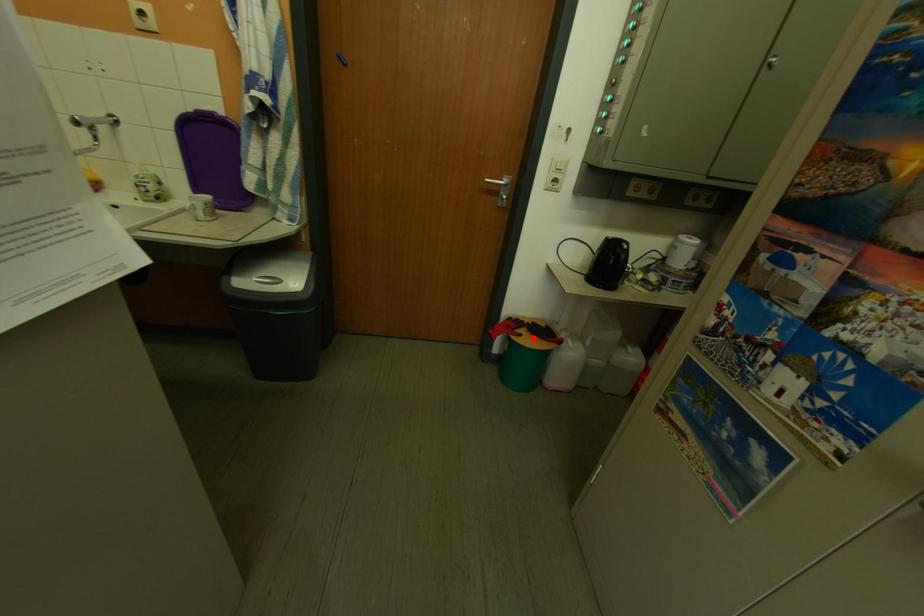
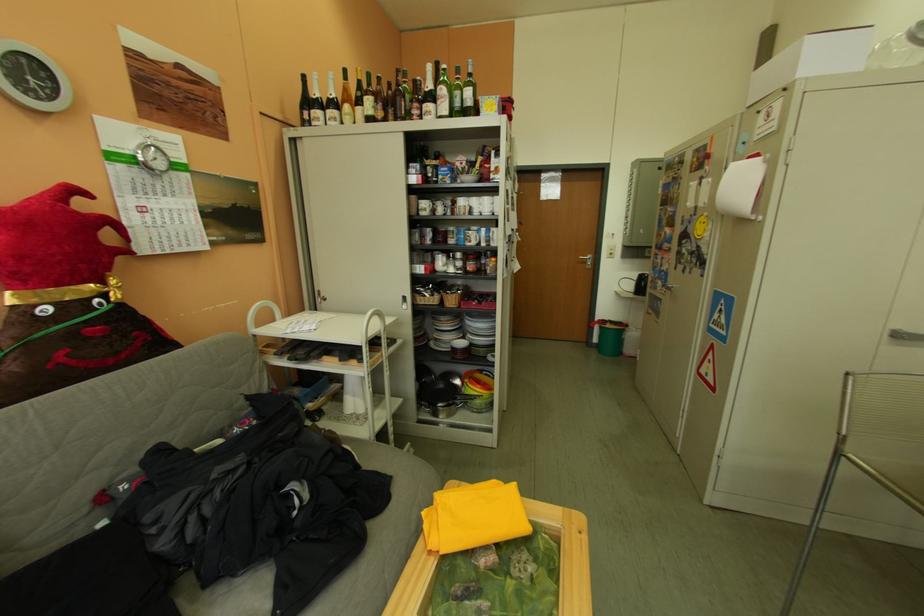
The point at the highlighted location is marked in the first image. Where is the corresponding point in the second image?

(617, 326)